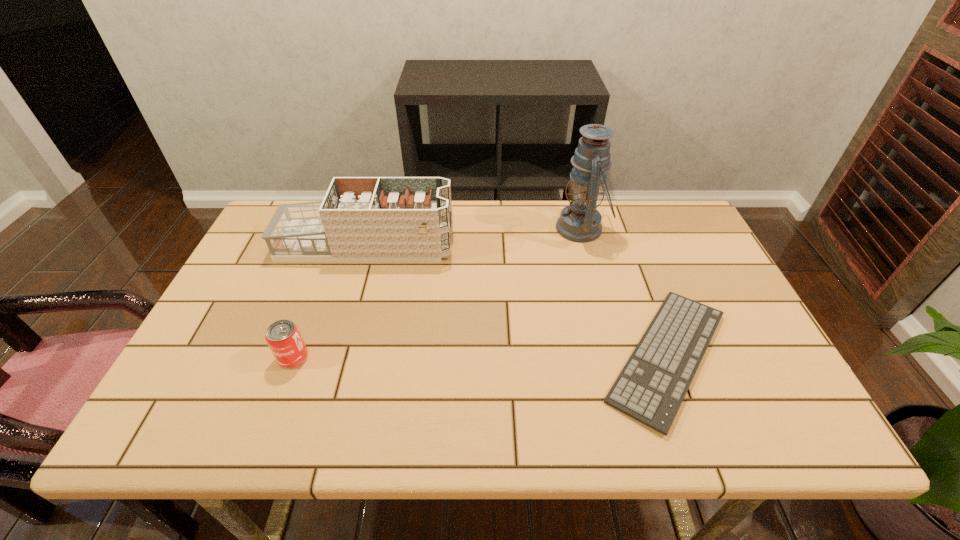
What are the coordinates of `free point between the can and the shortest object` in the screenshot? It's located at (480, 356).

Identify which object is the second nearest to the can. Please provide its 2D coordinates. Your answer should be formatted as a tuple, i.e. [(x, y)], where the tuple contains the x and y coordinates of a point satisfying the conditions above.

[(651, 387)]

Locate which object is the second closest to the tallest object. Please provide its 2D coordinates. Your answer should be formatted as a tuple, i.e. [(x, y)], where the tuple contains the x and y coordinates of a point satisfying the conditions above.

[(360, 218)]

Where is `vacant point that satisfies the following two spatial constraints: 1. on the front-facing side of the tallest object; 2. on the front side of the third tallest object`? The height and width of the screenshot is (540, 960). vacant point that satisfies the following two spatial constraints: 1. on the front-facing side of the tallest object; 2. on the front side of the third tallest object is located at coordinates (616, 357).

This screenshot has width=960, height=540. Identify the location of vacant space that satisfies the following two spatial constraints: 1. at the entrance of the computer keyboard; 2. on the left side of the dollhouse. (334, 356).

You are a GUI agent. You are given a task and a screenshot of the screen. Output one action in this format:
    pyautogui.click(x=<x>, y=<y>)
    Task: Click on the vacant position in the image that satisfies the following two spatial constraints: 1. at the entrance of the computer keyboard; 2. on the right side of the second tallest object
    
    Given the screenshot: What is the action you would take?
    pyautogui.click(x=334, y=356)

Locate an element on the screen. vacant space that satisfies the following two spatial constraints: 1. on the front-facing side of the lantern; 2. on the right side of the shortest object is located at coordinates (615, 356).

Where is `free space that satisfies the following two spatial constraints: 1. at the entrance of the third shortest object; 2. on the right side of the shortest object`? Image resolution: width=960 pixels, height=540 pixels. free space that satisfies the following two spatial constraints: 1. at the entrance of the third shortest object; 2. on the right side of the shortest object is located at coordinates (334, 356).